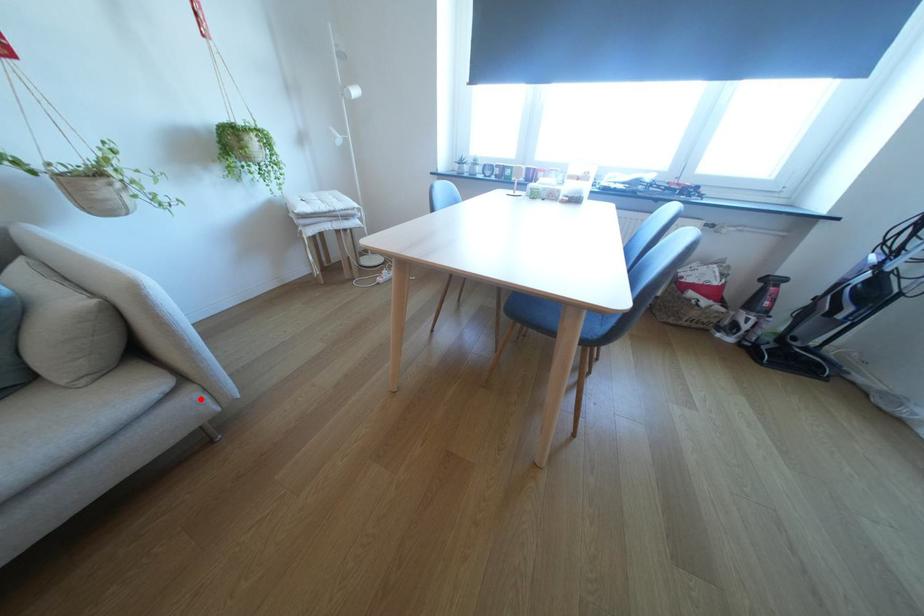
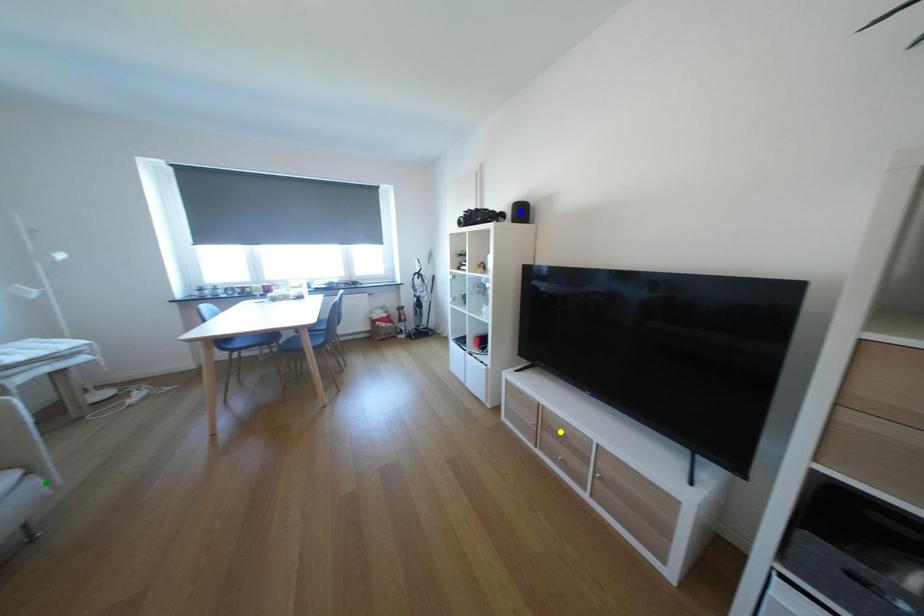
Question: I am providing you with two images of the same scene from different viewpoints. A red point is marked on the first image. You are given multiple points on the second image. Which point in image 2 is actually the same real-world point as the red point in image 1?

Choices:
 (A) blue point
 (B) green point
 (C) yellow point

Answer: (B)